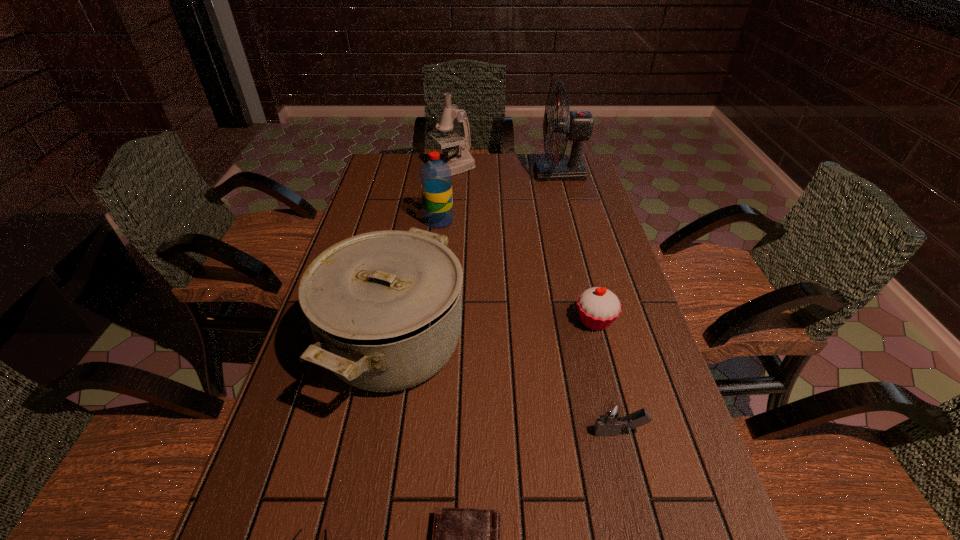
Where is `object that is at the far right corner`? Image resolution: width=960 pixels, height=540 pixels. object that is at the far right corner is located at coordinates (578, 125).

Where is `vacant space at the far edge`? The width and height of the screenshot is (960, 540). vacant space at the far edge is located at coordinates (516, 167).

Find the location of `free spot at the left edge of the desktop`. free spot at the left edge of the desktop is located at coordinates (280, 444).

Where is `vacant space at the right edge`? vacant space at the right edge is located at coordinates (622, 262).

Where is `vacant space at the far right corner of the desktop`? Image resolution: width=960 pixels, height=540 pixels. vacant space at the far right corner of the desktop is located at coordinates (551, 156).

What are the coordinates of `vacant region between the seventh shortest object and the igniter` in the screenshot? It's located at (536, 301).

You are a GUI agent. You are given a task and a screenshot of the screen. Output one action in this format:
    pyautogui.click(x=<x>, y=<y>)
    Task: Click on the free space between the cupcake and the saucepan
    This screenshot has height=540, width=960.
    Given the screenshot: What is the action you would take?
    pyautogui.click(x=494, y=332)

The height and width of the screenshot is (540, 960). What are the coordinates of `object that is the second nearest to the saucepan` in the screenshot? It's located at (300, 530).

Where is `object that is the second closest to the water bottle`? object that is the second closest to the water bottle is located at coordinates (385, 308).

Where is `vacant area that satisfies the following two spatial constraints: 1. on the front label of the sixth nearest object; 2. on the left side of the igniter`? The image size is (960, 540). vacant area that satisfies the following two spatial constraints: 1. on the front label of the sixth nearest object; 2. on the left side of the igniter is located at coordinates (414, 433).